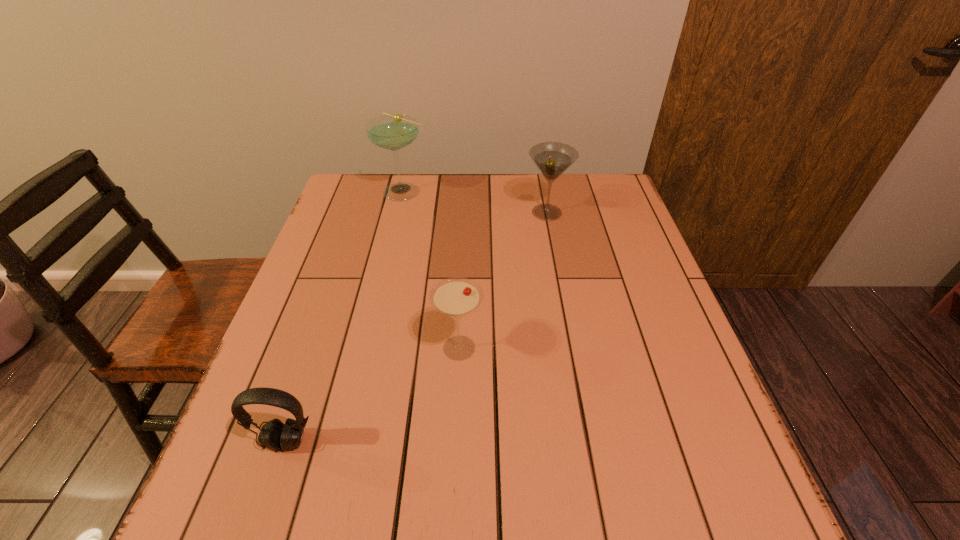
Where is `headset at the left edge`? The height and width of the screenshot is (540, 960). headset at the left edge is located at coordinates (274, 435).

Where is `object that is at the far left corner`? object that is at the far left corner is located at coordinates (393, 132).

This screenshot has width=960, height=540. In the image, there is a desktop. What are the coordinates of `blank space at the far edge` in the screenshot? It's located at (444, 194).

Find the location of a particular element. The image size is (960, 540). free region at the near edge of the desktop is located at coordinates point(417,534).

Where is `free space at the left edge of the desktop`? The width and height of the screenshot is (960, 540). free space at the left edge of the desktop is located at coordinates (273, 420).

You are a GUI agent. You are given a task and a screenshot of the screen. Output one action in this format:
    pyautogui.click(x=<x>, y=<y>)
    Task: Click on the free space at the right edge of the desktop
    The image size is (960, 540).
    Given the screenshot: What is the action you would take?
    pyautogui.click(x=625, y=376)

The height and width of the screenshot is (540, 960). I want to click on free spot at the far left corner of the desktop, so click(372, 199).

Locate an element on the screen. The height and width of the screenshot is (540, 960). free space between the leftmost martini and the nearest object is located at coordinates (346, 316).

Where is `free space between the headset and the rightmost martini`? The width and height of the screenshot is (960, 540). free space between the headset and the rightmost martini is located at coordinates click(x=417, y=327).

This screenshot has height=540, width=960. In order to click on free space between the leftmost martini and the third farthest object in this screenshot , I will do `click(432, 269)`.